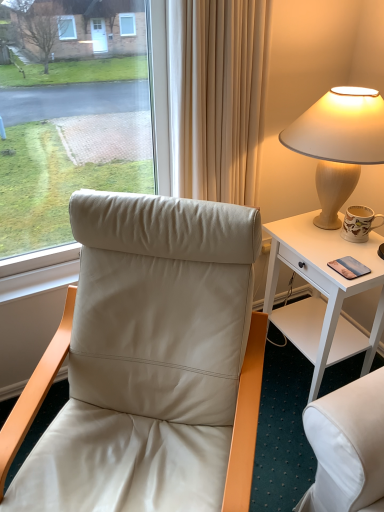
Image resolution: width=384 pixels, height=512 pixels. In order to click on blank space situated above white wood desk at right (from a real-world perspective) in this screenshot , I will do `click(333, 247)`.